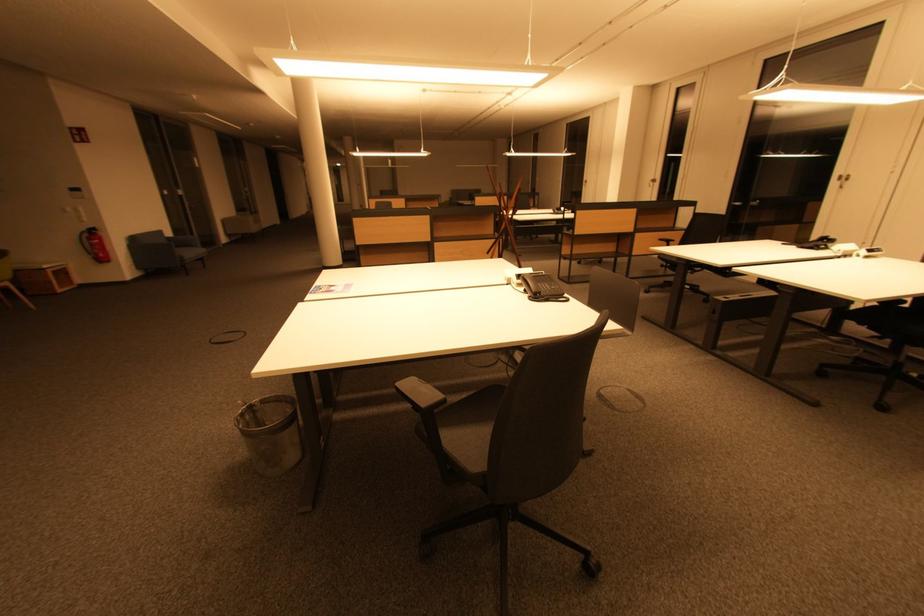
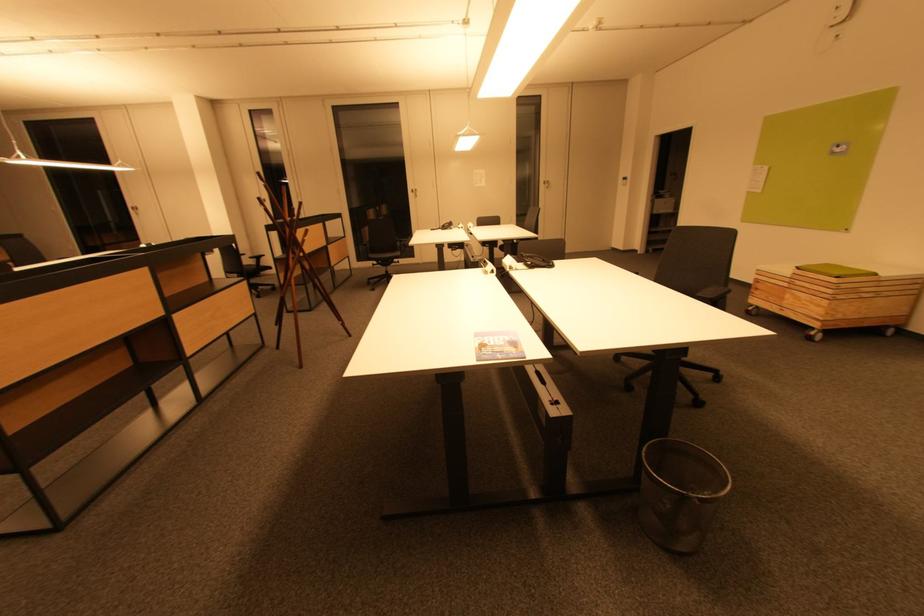
Where in the second image is the point corresponding to (854,177) from the first image?

(419, 191)